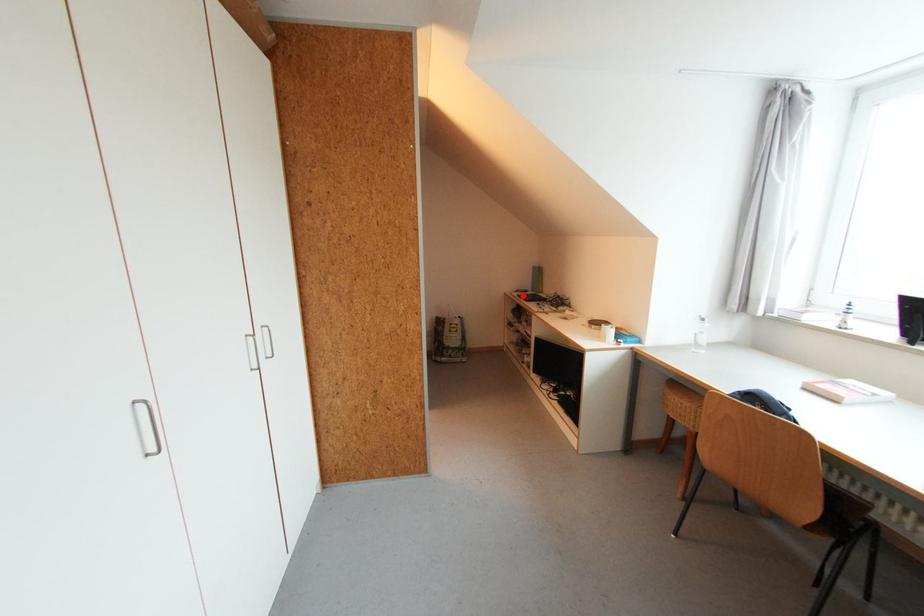
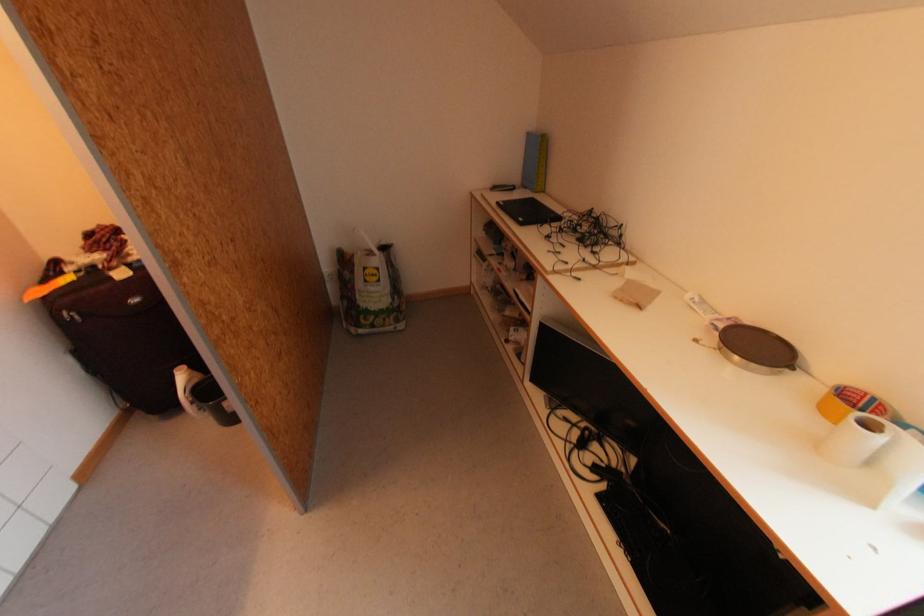
Question: I am providing you with two images of the same scene from different viewpoints. In image1, a red point is highlighted. Considering the same 3D point in image2, which of the following is correct?

Choices:
 (A) It is closer
 (B) It is farther

Answer: (A)